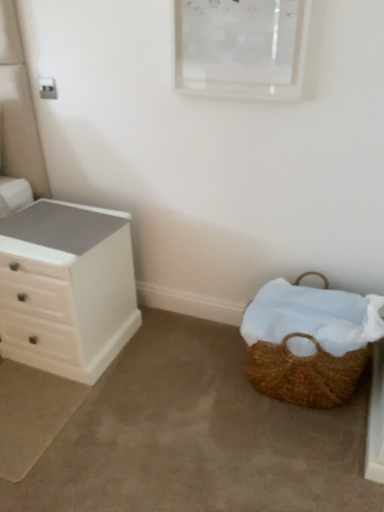
Question: Do you think white matte chest of drawers at left is within brown woven picnic basket at lower right, or outside of it?

Choices:
 (A) inside
 (B) outside

Answer: (B)

Question: Is point (87, 354) positioned closer to the camera than point (350, 329)?

Choices:
 (A) farther
 (B) closer

Answer: (A)

Question: Looking at their shapes, would you say white matte chest of drawers at left is wider or thinner than brown woven picnic basket at lower right?

Choices:
 (A) wide
 (B) thin

Answer: (A)

Question: Considering the positions of point (360, 320) and point (91, 370), is point (360, 320) closer or farther from the camera than point (91, 370)?

Choices:
 (A) closer
 (B) farther

Answer: (A)

Question: Considering their positions, is brown woven picnic basket at lower right located in front of or behind white matte chest of drawers at left?

Choices:
 (A) front
 (B) behind

Answer: (A)

Question: Is brown woven picnic basket at lower right inside the boundaries of white matte chest of drawers at left, or outside?

Choices:
 (A) inside
 (B) outside

Answer: (B)

Question: Based on their positions, is brown woven picnic basket at lower right located to the left or right of white matte chest of drawers at left?

Choices:
 (A) right
 (B) left

Answer: (A)